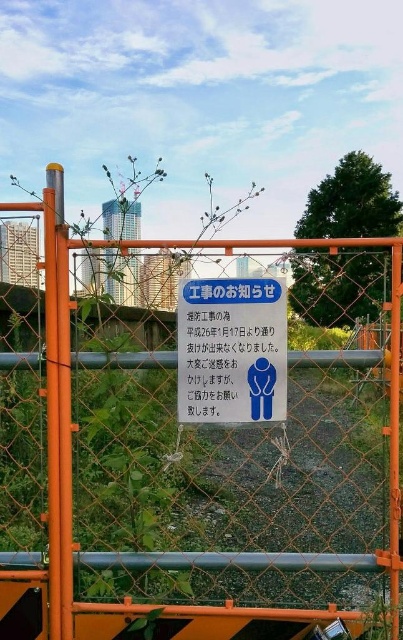
In the scene shown: You are a delivery driver approaching the construction site. You need to determine if the orange chain link fence at center is blocking your path to the delivery entrance located at point (193,456). Can you confirm if the fence is in your way?

The orange chain link fence at center is located at point (193,456), so yes, the fence is blocking your path to the delivery entrance at that point.